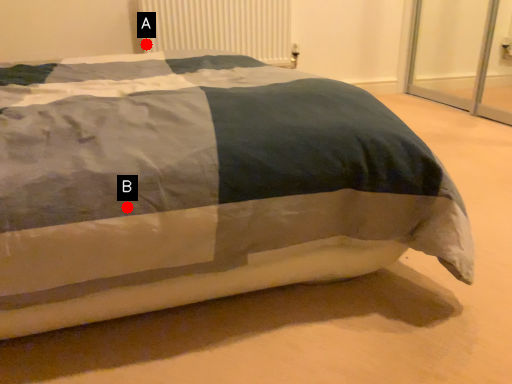
Question: Two points are circled on the image, labeled by A and B beside each circle. Among these points, which one is nearest to the camera?

Choices:
 (A) A is closer
 (B) B is closer

Answer: (B)